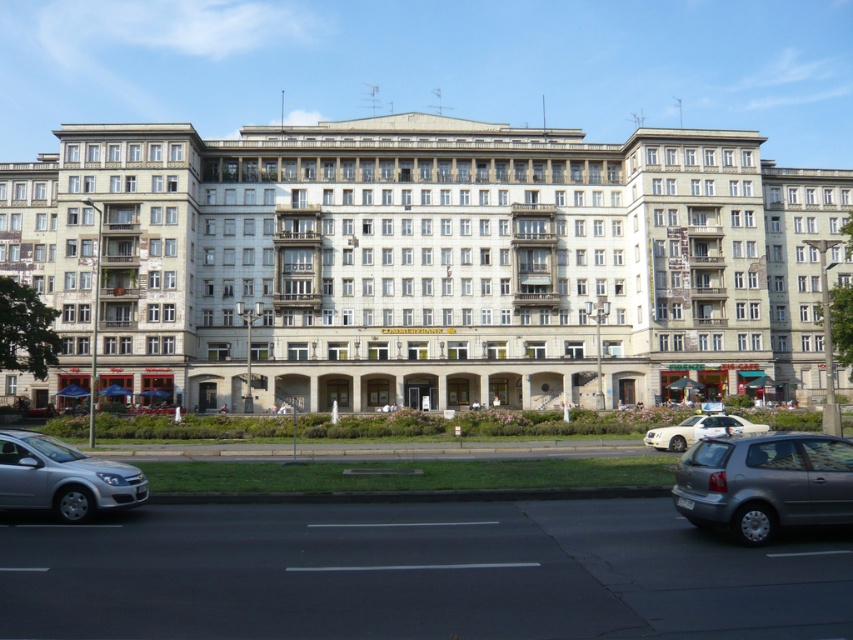
You are standing on the sidewalk in front of the white concrete building at center. You want to cross the street to reach the silver metallic sedan at lower left. Is the sedan directly in front of the building or positioned to the side?

The white concrete building at center is located above the silver metallic sedan at lower left, meaning the sedan is positioned to the side of the building rather than directly in front.

You are standing on the street in front of the building and want to take a photo that includes both point [547,232] and point [699,516]. Which point will appear closer to the front of the image?

Point [547,232] is further to the viewer than point [699,516], so it will appear closer to the front of the image.

You are a delivery driver approaching the building and need to park between the silver metallic sedan at lower left and the white glossy sedan at center. Given that your delivery van is 1.8 meters tall, will there be enough vertical clearance to park between them?

The silver metallic sedan at lower left is taller than the white glossy sedan at center. Since the silver metallic sedan at lower left is the tallest vehicle in the parking area, and its height is not specified, it is uncertain whether the delivery van will have enough vertical clearance to park between them.